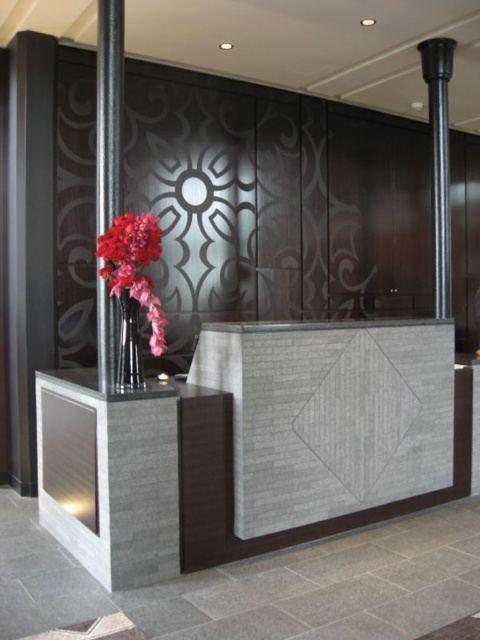
You are a visitor entering the lobby and see the black polished column at left and the matte glass vase at left. Which object is located more to the left side?

The black polished column at left is positioned on the left side of the matte glass vase at left, so it is more to the left.

You are organizing a floral arrangement display in the lobby. You have two vases available. The matte glass vase at left and the shiny metallic vase at center. Which vase can hold a larger bouquet of flowers?

The matte glass vase at left has a larger size compared to the shiny metallic vase at center, so it can hold a larger bouquet of flowers.

You are a maintenance worker needing to reach the polished metal pole at upper right for inspection. You have a ladder that is 4 meters long. Can you safely reach the pole with your ladder?

The distance between the polished metal pole at upper right and the camera is 4.16 meters. Since the ladder is only 4 meters long, it is 16 centimeters shorter than required. Therefore, the ladder is not long enough to safely reach the polished metal pole at upper right.